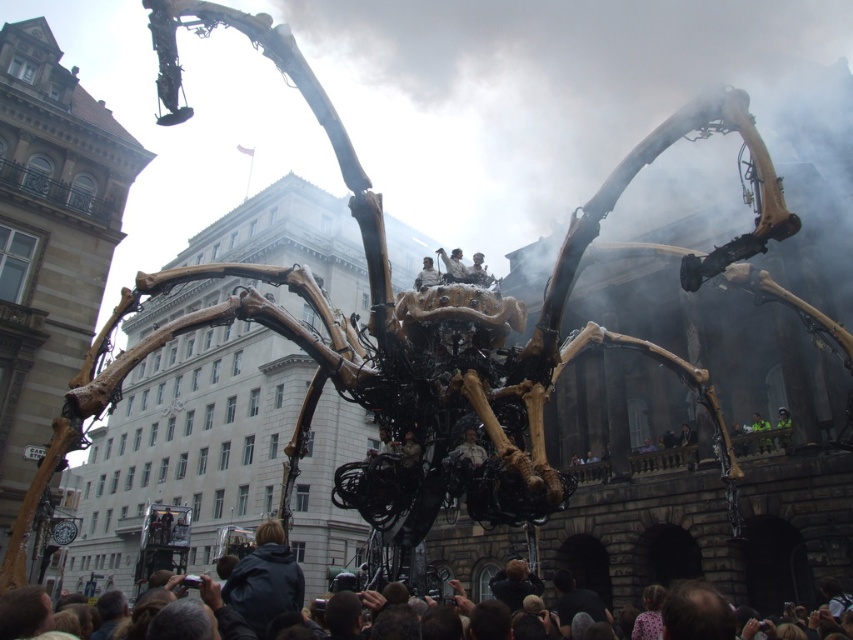
Between light brown leather jacket at center and green fabric person at lower right, which one appears on the left side from the viewer's perspective?

light brown leather jacket at center

Who is more forward, (431,266) or (769,426)?

Point (431,266)

This screenshot has width=853, height=640. Find the location of `light brown leather jacket at center`. light brown leather jacket at center is located at coordinates (427, 275).

Does dark blue jacket at lower center have a greater width compared to green fabric person at lower right?

Yes, dark blue jacket at lower center is wider than green fabric person at lower right.

Does dark blue jacket at lower center appear on the left side of green fabric person at lower right?

Indeed, dark blue jacket at lower center is positioned on the left side of green fabric person at lower right.

Does point (280, 609) lie behind point (762, 438)?

That is False.

Find the location of a particular element. This screenshot has height=640, width=853. dark blue jacket at lower center is located at coordinates (265, 580).

Is point (286, 561) positioned before point (405, 440)?

That is True.

Does dark blue jacket at lower center appear on the left side of wooden figure at center?

Yes, dark blue jacket at lower center is to the left of wooden figure at center.

Who is more distant from viewer, (285, 605) or (401, 451)?

The point (401, 451) is more distant.

You are a GUI agent. You are given a task and a screenshot of the screen. Output one action in this format:
    pyautogui.click(x=<x>, y=<y>)
    Task: Click on the dark blue jacket at lower center
    This screenshot has height=640, width=853.
    Given the screenshot: What is the action you would take?
    pyautogui.click(x=265, y=580)